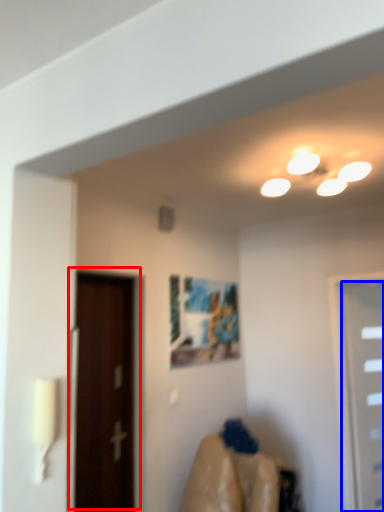
Question: Which object appears farthest to the camera in this image, door (highlighted by a red box) or door (highlighted by a blue box)?

Choices:
 (A) door
 (B) door

Answer: (B)